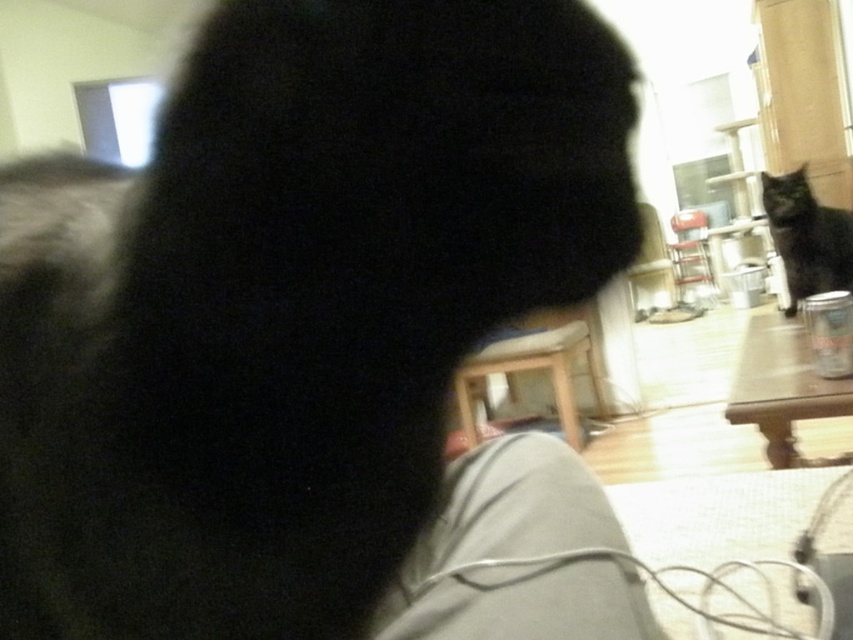
Question: Does gray fabric at lower center appear under black fuzzy cat at upper right?

Choices:
 (A) yes
 (B) no

Answer: (A)

Question: Which object is farther from the camera taking this photo?

Choices:
 (A) black fuzzy cat at upper right
 (B) gray fabric at lower center

Answer: (A)

Question: Among these objects, which one is farthest from the camera?

Choices:
 (A) gray fabric at lower center
 (B) black fuzzy cat at upper right

Answer: (B)

Question: Is gray fabric at lower center in front of black fuzzy cat at upper right?

Choices:
 (A) yes
 (B) no

Answer: (A)

Question: Which of the following is the farthest from the observer?

Choices:
 (A) (844, 282)
 (B) (486, 556)

Answer: (A)

Question: From the image, what is the correct spatial relationship of gray fabric at lower center in relation to black fuzzy cat at upper right?

Choices:
 (A) left
 (B) right

Answer: (A)